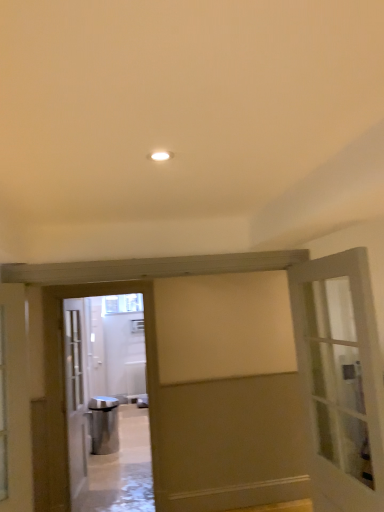
What is the approximate height of clear glass window at center?

38.01 centimeters.

Measure the distance between point (104, 313) and camera.

A distance of 24.43 feet exists between point (104, 313) and camera.

Image resolution: width=384 pixels, height=512 pixels. Describe the element at coordinates (103, 369) in the screenshot. I see `silver metallic elevator at center` at that location.

Measure the distance between point [66,337] and camera.

A distance of 4.03 meters exists between point [66,337] and camera.

What do you see at coordinates (340, 379) in the screenshot? This screenshot has width=384, height=512. I see `matte gray door at right, acting as the first door starting from the right` at bounding box center [340, 379].

Where is `white glass door at left, the 1th door when ordered from back to front`? The width and height of the screenshot is (384, 512). white glass door at left, the 1th door when ordered from back to front is located at coordinates (75, 395).

Identify the location of clear glass window at center. Image resolution: width=384 pixels, height=512 pixels. (122, 303).

From the image's perspective, is white glass door at left, the 2th door when ordered from front to back, beneath matte gray door at right, arranged as the 2th door when viewed from the back?

Yes.

Consider the image. Is white glass door at left, marked as the first door in a left-to-right arrangement, at the left side of matte gray door at right, arranged as the 2th door when viewed from the back?

Yes.

Does white glass door at left, the 1th door when ordered from back to front, come behind matte gray door at right, the 1th door when ordered from front to back?

Yes, the depth of white glass door at left, the 1th door when ordered from back to front, is greater than that of matte gray door at right, the 1th door when ordered from front to back.

From their relative heights in the image, would you say white glass door at left, the 1th door when ordered from back to front, is taller or shorter than matte gray door at right, arranged as the 2th door when viewed from the back?

Clearly, white glass door at left, the 1th door when ordered from back to front, is taller compared to matte gray door at right, arranged as the 2th door when viewed from the back.

Consider the image. From the image's perspective, does white glass door at left, the 2th door when ordered from front to back, appear lower than silver metallic elevator at center?

Yes, from the image's perspective, white glass door at left, the 2th door when ordered from front to back, is beneath silver metallic elevator at center.

Is silver metallic elevator at center located within white glass door at left, the 2th door when ordered from front to back?

No, white glass door at left, the 2th door when ordered from front to back, does not contain silver metallic elevator at center.

Does white glass door at left, the 2th door when ordered from front to back, have a smaller size compared to silver metallic elevator at center?

Actually, white glass door at left, the 2th door when ordered from front to back, might be larger than silver metallic elevator at center.

What's the angular difference between white glass door at left, marked as the first door in a left-to-right arrangement, and silver metallic elevator at center's facing directions?

white glass door at left, marked as the first door in a left-to-right arrangement, and silver metallic elevator at center are facing 81.1 degrees away from each other.

Is white glass door at left, the 2th door when ordered from front to back, wider than clear glass window at center?

Yes.

From the image's perspective, is white glass door at left, marked as the first door in a left-to-right arrangement, located above or below clear glass window at center?

white glass door at left, marked as the first door in a left-to-right arrangement, is below clear glass window at center.

Based on the photo, is white glass door at left, which is the 2th door in right-to-left order, taller than clear glass window at center?

Yes, white glass door at left, which is the 2th door in right-to-left order, is taller than clear glass window at center.

From the picture: Does white glass door at left, the 1th door when ordered from back to front, appear on the left side of clear glass window at center?

In fact, white glass door at left, the 1th door when ordered from back to front, is to the right of clear glass window at center.

Measure the distance from clear glass window at center to matte gray door at right, the second door viewed from the left.

clear glass window at center and matte gray door at right, the second door viewed from the left, are 4.77 meters apart.

Find the location of `window behind the matte gray door at right, the second door viewed from the left`. window behind the matte gray door at right, the second door viewed from the left is located at coordinates (122, 303).

Based on their sizes in the image, would you say clear glass window at center is bigger or smaller than matte gray door at right, the second door viewed from the left?

In the image, clear glass window at center appears to be smaller than matte gray door at right, the second door viewed from the left.

Does clear glass window at center turn towards matte gray door at right, the second door viewed from the left?

Yes, clear glass window at center is aimed at matte gray door at right, the second door viewed from the left.

Is silver metallic elevator at center not close to white glass door at left, which is the 2th door in right-to-left order?

Absolutely, silver metallic elevator at center is distant from white glass door at left, which is the 2th door in right-to-left order.

Between silver metallic elevator at center and white glass door at left, which is the 2th door in right-to-left order, which one is positioned behind?

white glass door at left, which is the 2th door in right-to-left order, is further away from the camera.

Is point (116, 375) positioned behind point (71, 467)?

Yes, point (116, 375) is behind point (71, 467).

From a real-world perspective, is matte gray door at right, arranged as the 2th door when viewed from the back, located beneath silver metallic elevator at center?

Incorrect, from a real-world perspective, matte gray door at right, arranged as the 2th door when viewed from the back, is higher than silver metallic elevator at center.

Considering the positions of objects matte gray door at right, arranged as the 2th door when viewed from the back, and silver metallic elevator at center in the image provided, who is behind, matte gray door at right, arranged as the 2th door when viewed from the back, or silver metallic elevator at center?

silver metallic elevator at center.

How different are the orientations of matte gray door at right, acting as the first door starting from the right, and silver metallic elevator at center in degrees?

89.9 degrees.

In the scene shown: Is matte gray door at right, arranged as the 2th door when viewed from the back, touching silver metallic elevator at center?

No.

Can you tell me how much matte gray door at right, the second door viewed from the left, and clear glass window at center differ in facing direction?

93 degrees separate the facing orientations of matte gray door at right, the second door viewed from the left, and clear glass window at center.

From the picture: Is matte gray door at right, the 1th door when ordered from front to back, behind clear glass window at center?

No.

From the image's perspective, is matte gray door at right, acting as the first door starting from the right, on top of clear glass window at center?

Yes, from the image's perspective, matte gray door at right, acting as the first door starting from the right, is over clear glass window at center.

Where is `door behind the matte gray door at right, the second door viewed from the left`? This screenshot has width=384, height=512. door behind the matte gray door at right, the second door viewed from the left is located at coordinates (75, 395).

Identify the location of elevator in front of the white glass door at left, the 1th door when ordered from back to front. This screenshot has height=512, width=384. (103, 369).

Estimate the real-world distances between objects in this image. Which object is further from matte gray door at right, the 1th door when ordered from front to back, silver metallic elevator at center or white glass door at left, which is the 2th door in right-to-left order?

Based on the image, silver metallic elevator at center appears to be further to matte gray door at right, the 1th door when ordered from front to back.

Looking at this image, based on their spatial positions, is silver metallic elevator at center or white glass door at left, marked as the first door in a left-to-right arrangement, closer to clear glass window at center?

silver metallic elevator at center lies closer to clear glass window at center than the other object.

Estimate the real-world distances between objects in this image. Which object is further from clear glass window at center, silver metallic elevator at center or matte gray door at right, the second door viewed from the left?

matte gray door at right, the second door viewed from the left, is positioned further to the anchor clear glass window at center.

Which object lies nearer to the anchor point matte gray door at right, the second door viewed from the left, white glass door at left, the 1th door when ordered from back to front, or clear glass window at center?

white glass door at left, the 1th door when ordered from back to front, lies closer to matte gray door at right, the second door viewed from the left, than the other object.

Considering their positions, is white glass door at left, which is the 2th door in right-to-left order, positioned closer to clear glass window at center than silver metallic elevator at center?

silver metallic elevator at center.

When comparing their distances from silver metallic elevator at center, does clear glass window at center or matte gray door at right, arranged as the 2th door when viewed from the back, seem further?

matte gray door at right, arranged as the 2th door when viewed from the back, is positioned further to the anchor silver metallic elevator at center.

When comparing their distances from white glass door at left, which is the 2th door in right-to-left order, does clear glass window at center or silver metallic elevator at center seem further?

clear glass window at center.

Based on their spatial positions, is matte gray door at right, the 1th door when ordered from front to back, or clear glass window at center further from white glass door at left, marked as the first door in a left-to-right arrangement?

matte gray door at right, the 1th door when ordered from front to back, lies further to white glass door at left, marked as the first door in a left-to-right arrangement, than the other object.

At what (x,y) coordinates should I click in order to perform the action: click on door between matte gray door at right, the 1th door when ordered from front to back, and clear glass window at center from front to back. Please return your answer as a coordinate pair (x, y). Looking at the image, I should click on (75, 395).

Locate an element on the screen. The image size is (384, 512). elevator positioned between matte gray door at right, the 1th door when ordered from front to back, and clear glass window at center from near to far is located at coordinates (103, 369).

Where is `elevator between matte gray door at right, acting as the first door starting from the right, and white glass door at left, which is the 2th door in right-to-left order, along the z-axis`? The image size is (384, 512). elevator between matte gray door at right, acting as the first door starting from the right, and white glass door at left, which is the 2th door in right-to-left order, along the z-axis is located at coordinates point(103,369).

You are a GUI agent. You are given a task and a screenshot of the screen. Output one action in this format:
    pyautogui.click(x=<x>, y=<y>)
    Task: Click on the door positioned between silver metallic elevator at center and clear glass window at center from near to far
    
    Given the screenshot: What is the action you would take?
    pyautogui.click(x=75, y=395)